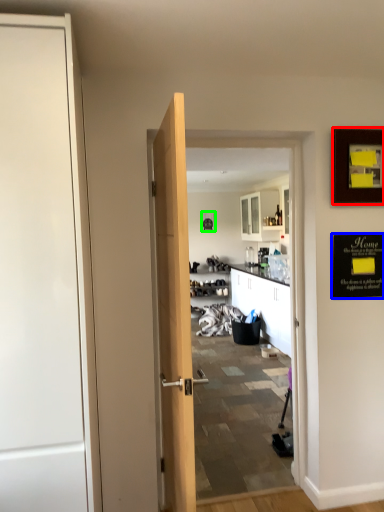
Question: Which is farther away from picture frame (highlighted by a red box)? bulletin board (highlighted by a blue box) or picture frame (highlighted by a green box)?

Choices:
 (A) bulletin board
 (B) picture frame

Answer: (B)